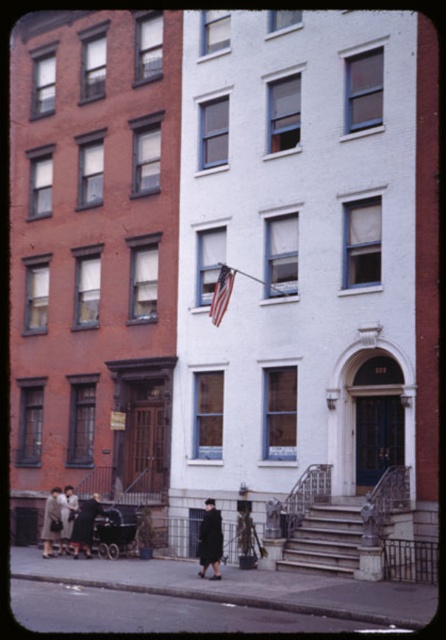
Between black wool coat at center and american flag at center, which one is positioned lower?

Positioned lower is black wool coat at center.

In the scene shown: Does black wool coat at center appear on the right side of american flag at center?

No, black wool coat at center is not to the right of american flag at center.

Locate an element on the screen. This screenshot has width=446, height=640. black wool coat at center is located at coordinates click(210, 540).

Is point (198, 547) more distant than point (66, 499)?

No, it is in front of (66, 499).

Between point (210, 554) and point (67, 545), which one is positioned in front?

Point (210, 554) is more forward.

At what (x,y) coordinates should I click in order to perform the action: click on black wool coat at center. Please return your answer as a coordinate pair (x, y). Image resolution: width=446 pixels, height=640 pixels. Looking at the image, I should click on (210, 540).

Identify the location of black wool coat at center. This screenshot has width=446, height=640. [210, 540].

Locate an element on the screen. The image size is (446, 640). dark brown leather coat at lower left is located at coordinates (86, 524).

Is dark brown leather coat at lower left below american flag at center?

Indeed, dark brown leather coat at lower left is positioned under american flag at center.

Where is `dark brown leather coat at lower left`? dark brown leather coat at lower left is located at coordinates (86, 524).